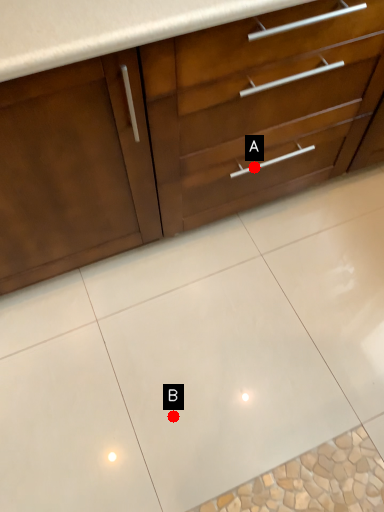
Question: Two points are circled on the image, labeled by A and B beside each circle. Which point is further to the camera?

Choices:
 (A) A is further
 (B) B is further

Answer: (A)